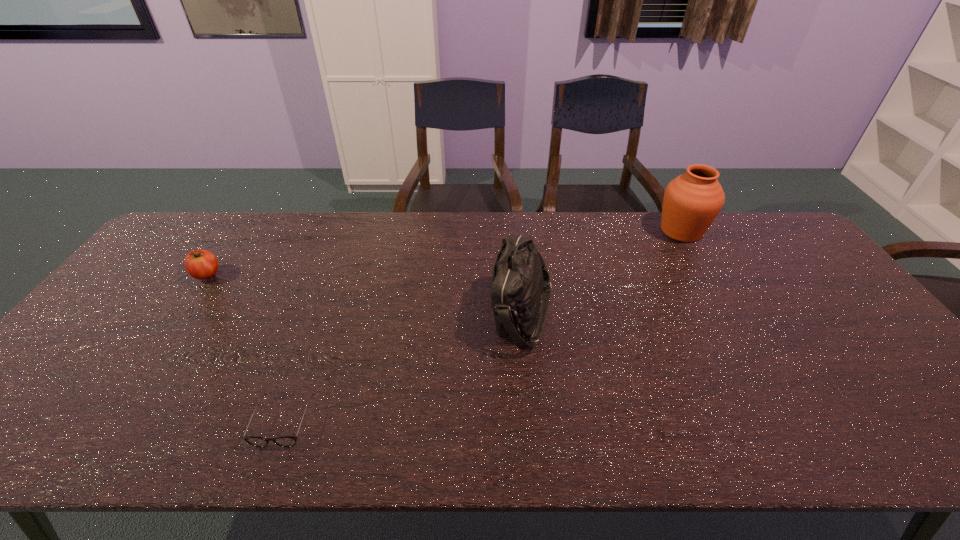
This screenshot has width=960, height=540. In order to click on free space in the image that satisfies the following two spatial constraints: 1. at the front padded panel of the shoulder bag; 2. through the lenses of the nearest object in this screenshot , I will do `click(533, 421)`.